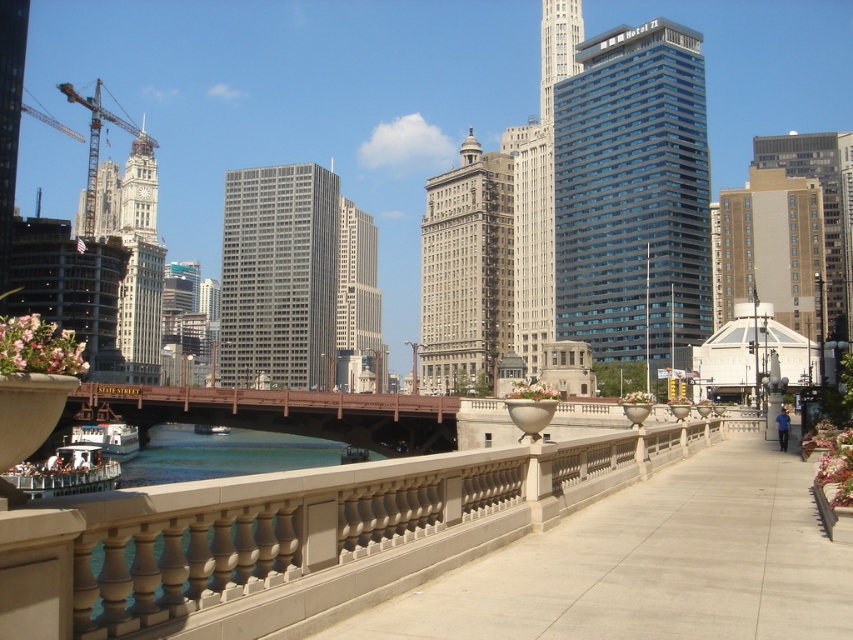
You are a city planner evaluating the riverfront walkway. You need to install a new bench that is 1.2 meters tall. Considering the smooth concrete pavement at center and the glassy blue skyscraper at upper right, which object would be more suitable for placing the bench near? Explain your reasoning based on their heights.

The smooth concrete pavement at center is not as tall as the glassy blue skyscraper at upper right. Since the bench is only 1.2 meters tall, it would be more suitable to place it near the smooth concrete pavement at center because the skyscraper is significantly taller, making the pavement a more appropriate location in terms of scale.